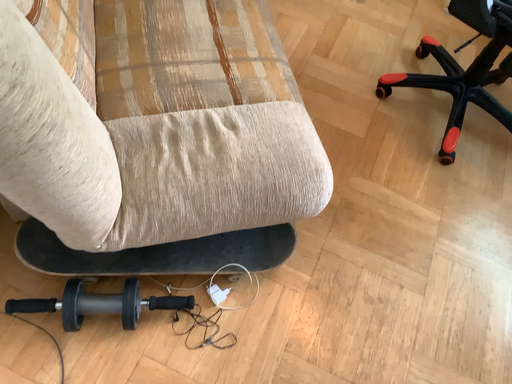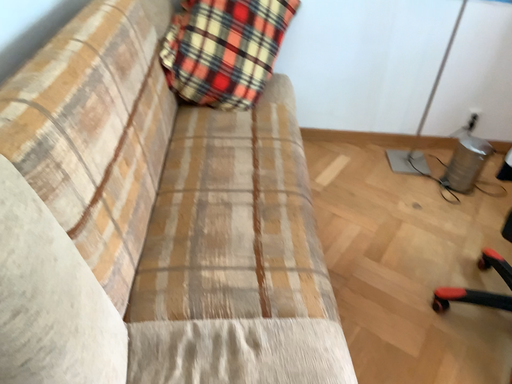
Question: How did the camera likely rotate when shooting the video?

Choices:
 (A) rotated right
 (B) rotated left

Answer: (B)